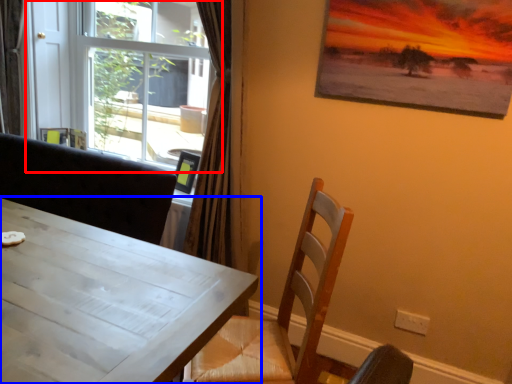
Question: Which of the following is the closest to the observer, window (highlighted by a red box) or table (highlighted by a blue box)?

Choices:
 (A) window
 (B) table

Answer: (B)